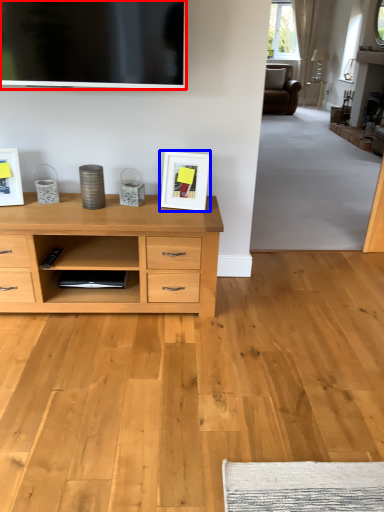
Question: Which object is closer to the camera taking this photo, television (highlighted by a red box) or picture frame (highlighted by a blue box)?

Choices:
 (A) television
 (B) picture frame

Answer: (A)